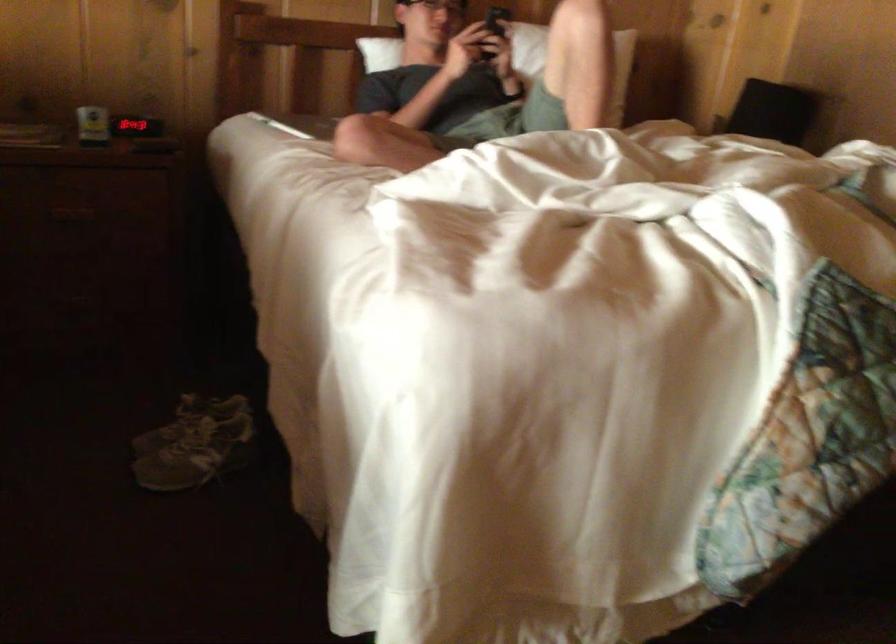
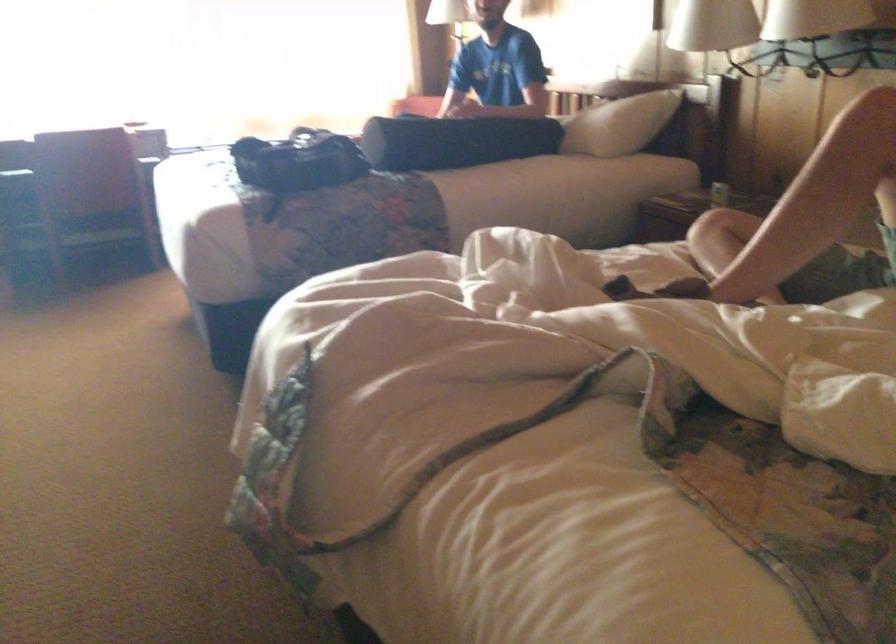
Question: I am providing you with two images of the same scene from different viewpoints. Which of the following objects are not visible in image2?

Choices:
 (A) red spray nozzle
 (B) beverage can
 (C) black bag
 (D) gray shoe

Answer: (D)